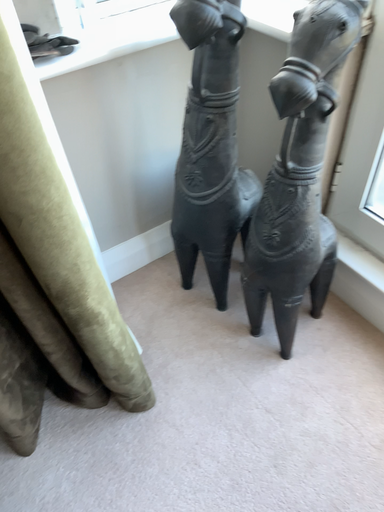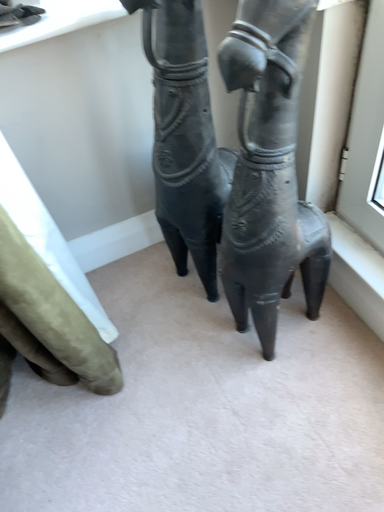
Question: Which way did the camera rotate in the video?

Choices:
 (A) rotated right
 (B) rotated left

Answer: (B)